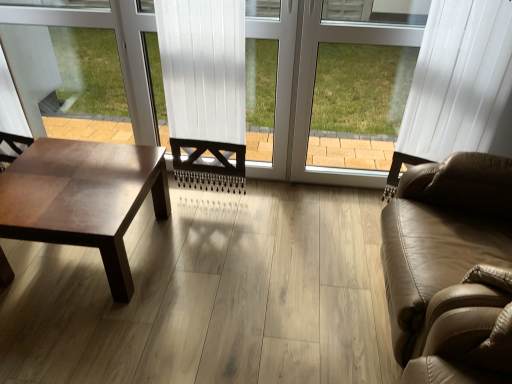
Question: Is white plastic window frame at center positioned before tan leather couch at right?

Choices:
 (A) no
 (B) yes

Answer: (A)

Question: Is white plastic window frame at center completely or partially outside of tan leather couch at right?

Choices:
 (A) yes
 (B) no

Answer: (A)

Question: Is white plastic window frame at center taller than tan leather couch at right?

Choices:
 (A) yes
 (B) no

Answer: (A)

Question: Does white plastic window frame at center lie behind tan leather couch at right?

Choices:
 (A) no
 (B) yes

Answer: (B)

Question: Could tan leather couch at right be considered to be inside white plastic window frame at center?

Choices:
 (A) no
 (B) yes

Answer: (A)

Question: Visually, is shiny brown wood coffee table at left positioned to the left or to the right of white plastic window frame at center?

Choices:
 (A) right
 (B) left

Answer: (B)

Question: Is shiny brown wood coffee table at left spatially inside white plastic window frame at center, or outside of it?

Choices:
 (A) inside
 (B) outside

Answer: (B)

Question: From a real-world perspective, is shiny brown wood coffee table at left positioned above or below white plastic window frame at center?

Choices:
 (A) above
 (B) below

Answer: (B)

Question: Is shiny brown wood coffee table at left wider or thinner than white plastic window frame at center?

Choices:
 (A) thin
 (B) wide

Answer: (B)

Question: Is point (495, 155) positioned closer to the camera than point (25, 218)?

Choices:
 (A) farther
 (B) closer

Answer: (A)

Question: In terms of width, does tan leather couch at right look wider or thinner when compared to shiny brown wood coffee table at left?

Choices:
 (A) wide
 (B) thin

Answer: (A)

Question: Is tan leather couch at right inside or outside of shiny brown wood coffee table at left?

Choices:
 (A) inside
 (B) outside

Answer: (B)

Question: In terms of height, does tan leather couch at right look taller or shorter compared to shiny brown wood coffee table at left?

Choices:
 (A) short
 (B) tall

Answer: (B)

Question: From a real-world perspective, is shiny brown wood coffee table at left physically located above or below tan leather couch at right?

Choices:
 (A) above
 (B) below

Answer: (B)

Question: Considering the relative positions of shiny brown wood coffee table at left and tan leather couch at right in the image provided, is shiny brown wood coffee table at left to the left or to the right of tan leather couch at right?

Choices:
 (A) left
 (B) right

Answer: (A)